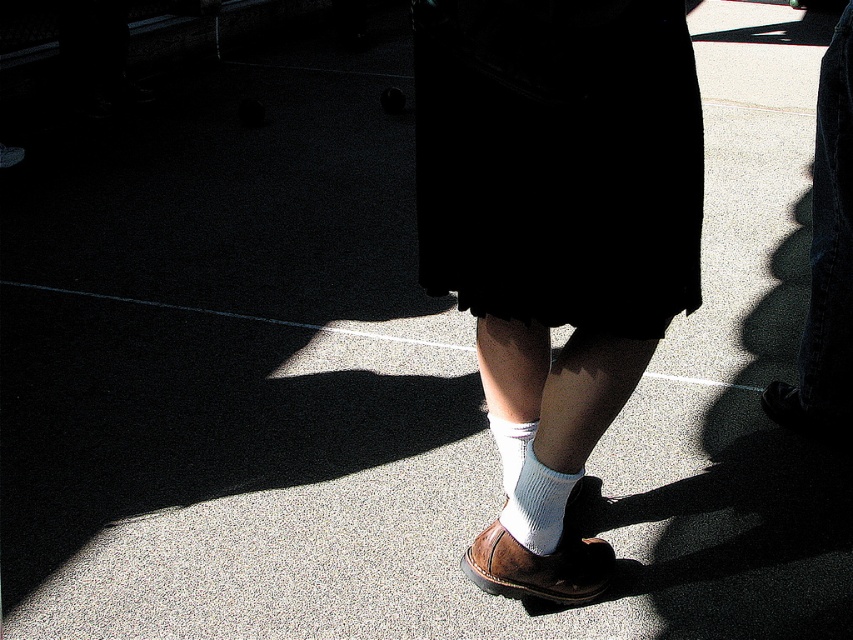
Which is more to the left, white cotton socks at center or white knitted sock at center?

Positioned to the left is white knitted sock at center.

Does white cotton socks at center have a larger size compared to white knitted sock at center?

Yes.

You are a GUI agent. You are given a task and a screenshot of the screen. Output one action in this format:
    pyautogui.click(x=<x>, y=<y>)
    Task: Click on the white cotton socks at center
    
    Given the screenshot: What is the action you would take?
    click(827, 264)

Identify the location of white cotton socks at center. The height and width of the screenshot is (640, 853). (827, 264).

Can you confirm if black fabric skirt at center is positioned below white knitted sock at lower center?

Actually, black fabric skirt at center is above white knitted sock at lower center.

Can you confirm if black fabric skirt at center is bigger than white knitted sock at lower center?

Correct, black fabric skirt at center is larger in size than white knitted sock at lower center.

Is point (570, 156) in front of point (576, 477)?

Yes, point (570, 156) is in front of point (576, 477).

The width and height of the screenshot is (853, 640). In order to click on black fabric skirt at center in this screenshot , I will do `click(560, 161)`.

Can you confirm if black fabric skirt at center is shorter than brown leather shoe at lower center?

No, black fabric skirt at center is not shorter than brown leather shoe at lower center.

Can you confirm if black fabric skirt at center is positioned to the right of brown leather shoe at lower center?

In fact, black fabric skirt at center is to the left of brown leather shoe at lower center.

Measure the distance between black fabric skirt at center and camera.

black fabric skirt at center is 3.97 feet away from camera.

I want to click on black fabric skirt at center, so click(560, 161).